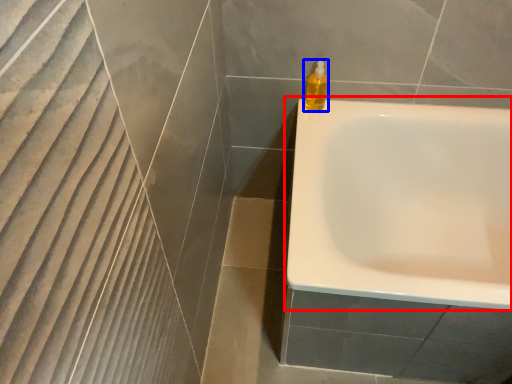
Question: Among these objects, which one is farthest to the camera, bathtub (highlighted by a red box) or soap dispenser (highlighted by a blue box)?

Choices:
 (A) bathtub
 (B) soap dispenser

Answer: (B)